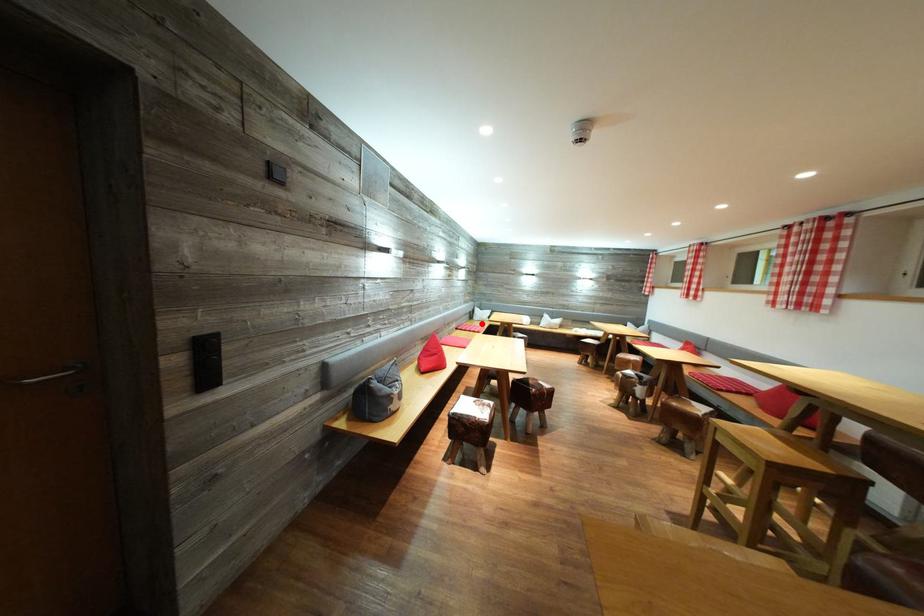
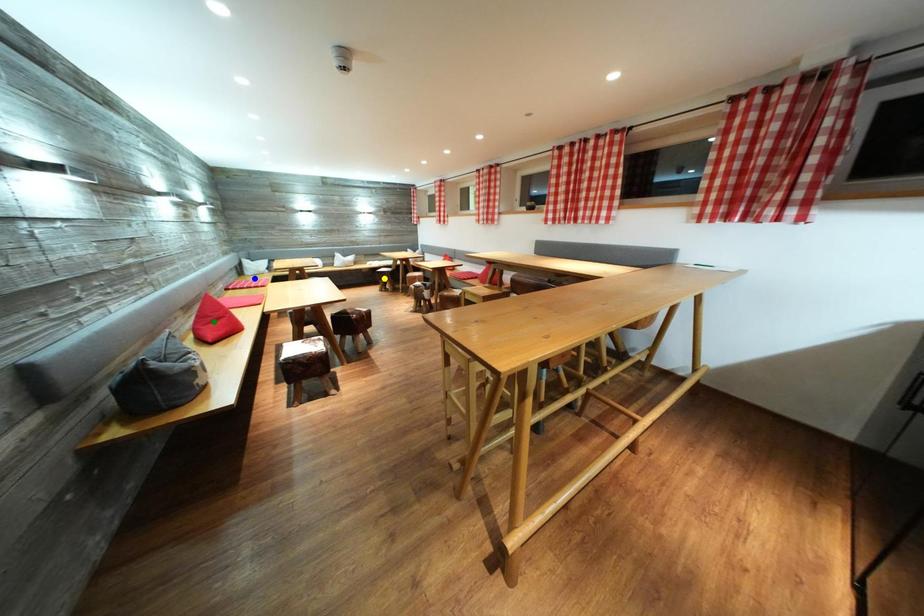
Question: I am providing you with two images of the same scene from different viewpoints. A red point is marked on the first image. You are given multiple points on the second image. Which point in image 2 is actually the same real-world point as the red point in image 1?

Choices:
 (A) yellow point
 (B) blue point
 (C) green point

Answer: (B)